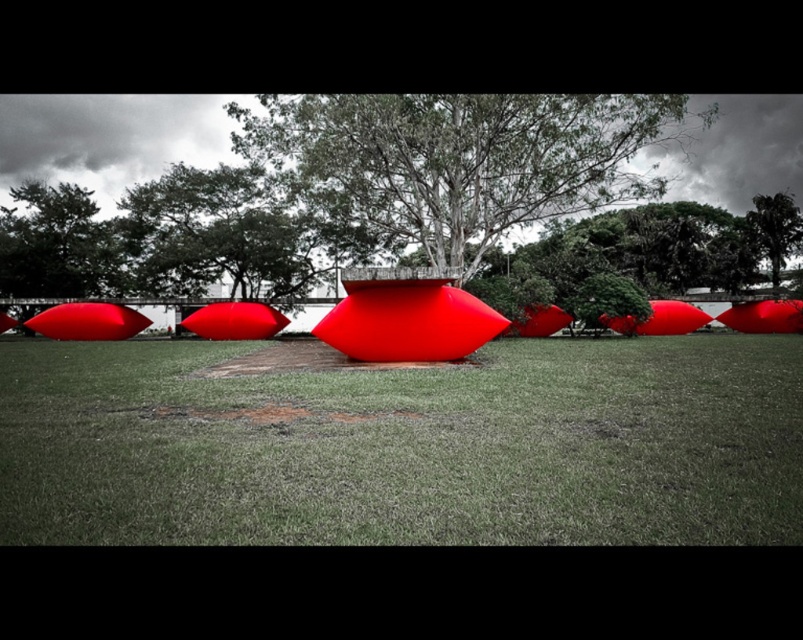
Looking at this image, you are an artist planning to photograph the matte red object at center and the green leafy tree at center from a distance. Based on their sizes, which one will appear larger in the photo?

The green leafy tree at center will appear larger in the photo because it is larger than the matte red object at center.

You are standing in the middle of the grassy field and see two points marked in the image. Which point, point (777,541) or point (760,218), is closer to you?

Point (777,541) is closer to the camera than point (760,218), so the point closer to you is point (777,541).